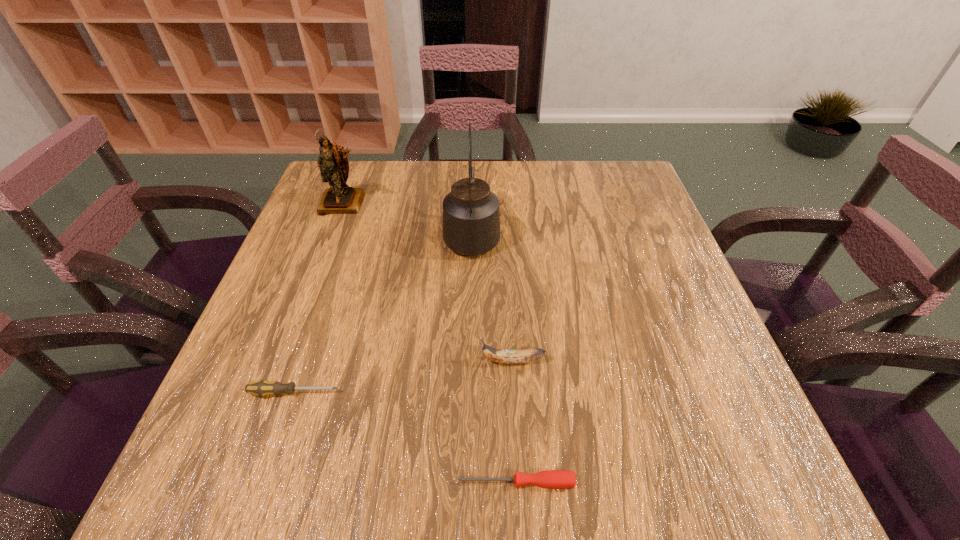
Where is `kettle`? kettle is located at coordinates [471, 215].

Identify the location of the second tallest object. The height and width of the screenshot is (540, 960). (334, 167).

Locate an element on the screen. the third farthest object is located at coordinates (502, 356).

The width and height of the screenshot is (960, 540). Find the location of `banana`. banana is located at coordinates (502, 356).

Find the location of a particular element. The image size is (960, 540). the fourth farthest object is located at coordinates (261, 388).

The height and width of the screenshot is (540, 960). What are the coordinates of `the farther screwdriver` in the screenshot? It's located at (261, 388).

Locate an element on the screen. The height and width of the screenshot is (540, 960). the right screwdriver is located at coordinates click(x=554, y=479).

Locate an element on the screen. Image resolution: width=960 pixels, height=540 pixels. the shorter screwdriver is located at coordinates (554, 479).

The width and height of the screenshot is (960, 540). I want to click on free location located 0.250m spout on the kettle, so click(473, 161).

You are a GUI agent. You are given a task and a screenshot of the screen. Output one action in this format:
    pyautogui.click(x=<x>, y=<y>)
    Task: Click on the vacant space situated spout on the kettle
    The height and width of the screenshot is (540, 960).
    Given the screenshot: What is the action you would take?
    pyautogui.click(x=473, y=179)